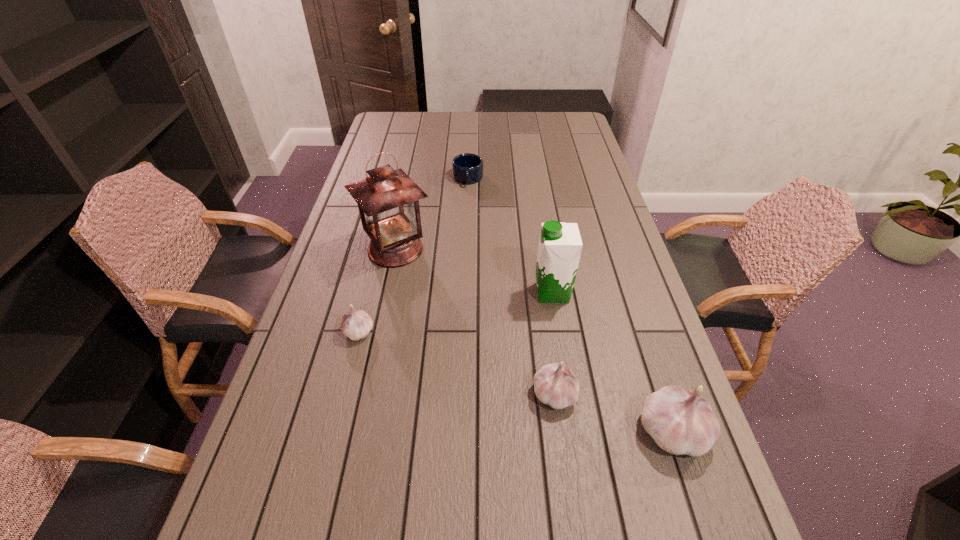
Identify the location of the shortest garlic. (356, 324).

Locate an element on the screen. The image size is (960, 540). the fifth tallest object is located at coordinates (356, 324).

The height and width of the screenshot is (540, 960). I want to click on the third shortest object, so click(x=555, y=385).

At what (x,y) coordinates should I click in order to perform the action: click on the second shortest garlic. Please return your answer as a coordinate pair (x, y). Looking at the image, I should click on (555, 385).

You are a GUI agent. You are given a task and a screenshot of the screen. Output one action in this format:
    pyautogui.click(x=<x>, y=<y>)
    Task: Click on the tallest garlic
    
    Given the screenshot: What is the action you would take?
    pyautogui.click(x=681, y=422)

Identify the location of the rightmost garlic. [681, 422].

At what (x,y) coordinates should I click in order to perform the action: click on mug. Please return your answer as a coordinate pair (x, y). Looking at the image, I should click on (467, 168).

The height and width of the screenshot is (540, 960). In order to click on the farthest object in this screenshot , I will do `click(467, 168)`.

Locate an element on the screen. soya milk is located at coordinates (560, 244).

Locate an element on the screen. the third farthest object is located at coordinates (560, 244).